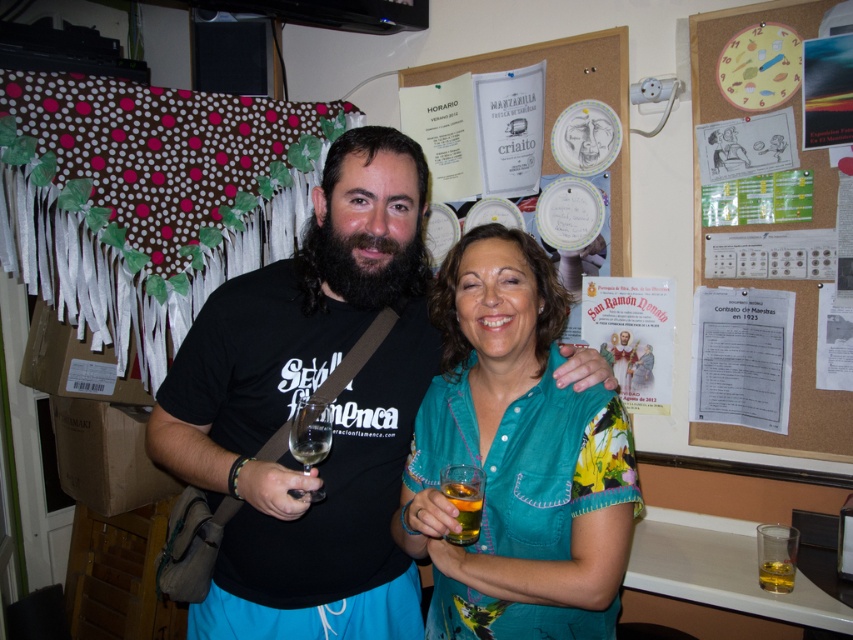
Question: Which of the following is the farthest from the observer?

Choices:
 (A) (451, 484)
 (B) (722, 412)

Answer: (B)

Question: Which of these objects is positioned closest to the wooden corkboard at right?

Choices:
 (A) translucent glass at lower right
 (B) clear glass wine glass at center
 (C) white paper poster at right

Answer: (C)

Question: Estimate the real-world distances between objects in this image. Which object is closer to the matte paper poster at upper right?

Choices:
 (A) black t-shirt at center
 (B) translucent glass at lower right
 (C) white paper poster at right

Answer: (C)

Question: Does teal floral blouse at center appear over translucent glass at lower right?

Choices:
 (A) no
 (B) yes

Answer: (B)

Question: Is white paper poster at right in front of clear glass wine glass at center?

Choices:
 (A) no
 (B) yes

Answer: (A)

Question: From the image, what is the correct spatial relationship of translucent glass at lower center in relation to translucent glass at lower right?

Choices:
 (A) right
 (B) left

Answer: (B)